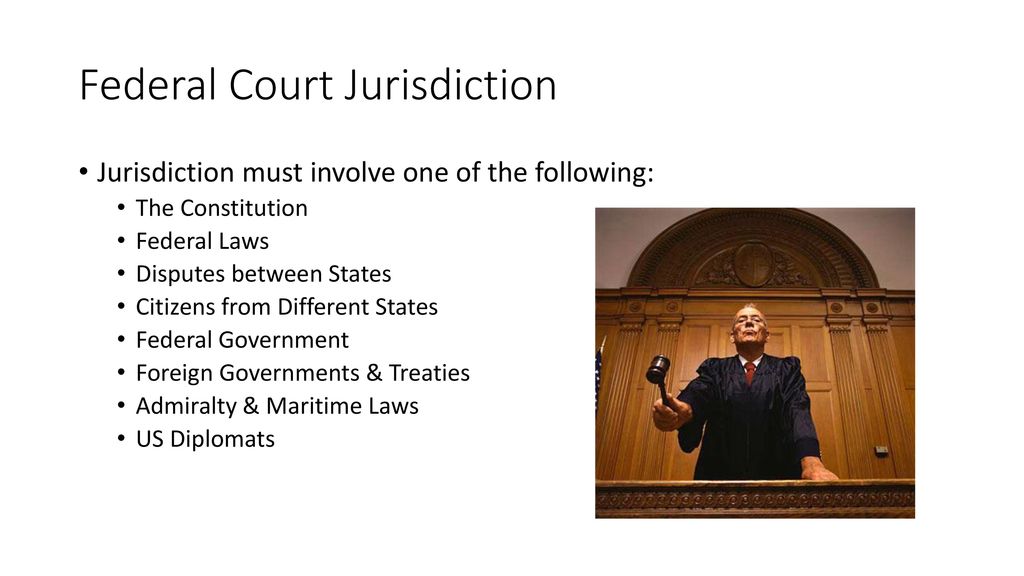
Where is `judge's bench`? The height and width of the screenshot is (576, 1024). judge's bench is located at coordinates (758, 500).